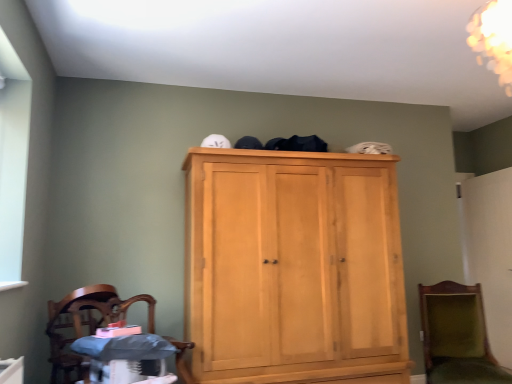
Question: Does wooden polished chair at lower left, arranged as the 1th chair when viewed from the left, have a lesser height compared to green velvet chair at lower right, the second chair viewed from the front?

Choices:
 (A) no
 (B) yes

Answer: (B)

Question: Can you confirm if wooden polished chair at lower left, which ranks as the first chair in front-to-back order, is bigger than green velvet chair at lower right, the 1th chair when ordered from right to left?

Choices:
 (A) yes
 (B) no

Answer: (B)

Question: Is the depth of wooden polished chair at lower left, arranged as the 2th chair when viewed from the back, less than that of green velvet chair at lower right, which appears as the first chair when viewed from the back?

Choices:
 (A) yes
 (B) no

Answer: (A)

Question: From the image's perspective, is wooden polished chair at lower left, which is the 2th chair in right-to-left order, above green velvet chair at lower right, which appears as the 2th chair when viewed from the left?

Choices:
 (A) yes
 (B) no

Answer: (A)

Question: Considering the relative sizes of wooden polished chair at lower left, which is the 2th chair in right-to-left order, and green velvet chair at lower right, which appears as the 2th chair when viewed from the left, in the image provided, is wooden polished chair at lower left, which is the 2th chair in right-to-left order, smaller than green velvet chair at lower right, which appears as the 2th chair when viewed from the left,?

Choices:
 (A) no
 (B) yes

Answer: (B)

Question: In terms of size, does matte gray changing table at lower left appear bigger or smaller than light wood cupboard at center?

Choices:
 (A) big
 (B) small

Answer: (B)

Question: Visually, is matte gray changing table at lower left positioned to the left or to the right of light wood cupboard at center?

Choices:
 (A) left
 (B) right

Answer: (A)

Question: In terms of height, does matte gray changing table at lower left look taller or shorter compared to light wood cupboard at center?

Choices:
 (A) short
 (B) tall

Answer: (A)

Question: From the image's perspective, relative to light wood cupboard at center, is matte gray changing table at lower left above or below?

Choices:
 (A) above
 (B) below

Answer: (B)

Question: In terms of size, does green velvet chair at lower right, the 1th chair when ordered from right to left, appear bigger or smaller than matte gray changing table at lower left?

Choices:
 (A) big
 (B) small

Answer: (A)

Question: Is green velvet chair at lower right, which appears as the 2th chair when viewed from the left, in front of or behind matte gray changing table at lower left in the image?

Choices:
 (A) behind
 (B) front

Answer: (A)

Question: Is green velvet chair at lower right, which appears as the 2th chair when viewed from the left, spatially inside matte gray changing table at lower left, or outside of it?

Choices:
 (A) inside
 (B) outside

Answer: (B)

Question: Is green velvet chair at lower right, which appears as the 2th chair when viewed from the left, to the left or to the right of matte gray changing table at lower left in the image?

Choices:
 (A) left
 (B) right

Answer: (B)

Question: Based on their positions, is matte gray changing table at lower left located to the left or right of green velvet chair at lower right, which appears as the first chair when viewed from the back?

Choices:
 (A) right
 (B) left

Answer: (B)

Question: Considering the positions of matte gray changing table at lower left and green velvet chair at lower right, the second chair viewed from the front, in the image, is matte gray changing table at lower left wider or thinner than green velvet chair at lower right, the second chair viewed from the front,?

Choices:
 (A) wide
 (B) thin

Answer: (B)